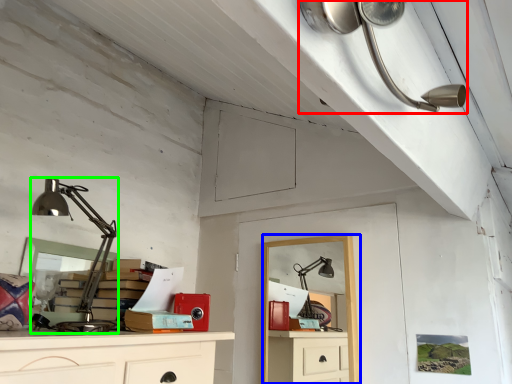
Question: Based on their relative distances, which object is nearer to lamp (highlighted by a red box)? Choose from computer desk (highlighted by a blue box) and lamp (highlighted by a green box).

Choices:
 (A) computer desk
 (B) lamp

Answer: (A)